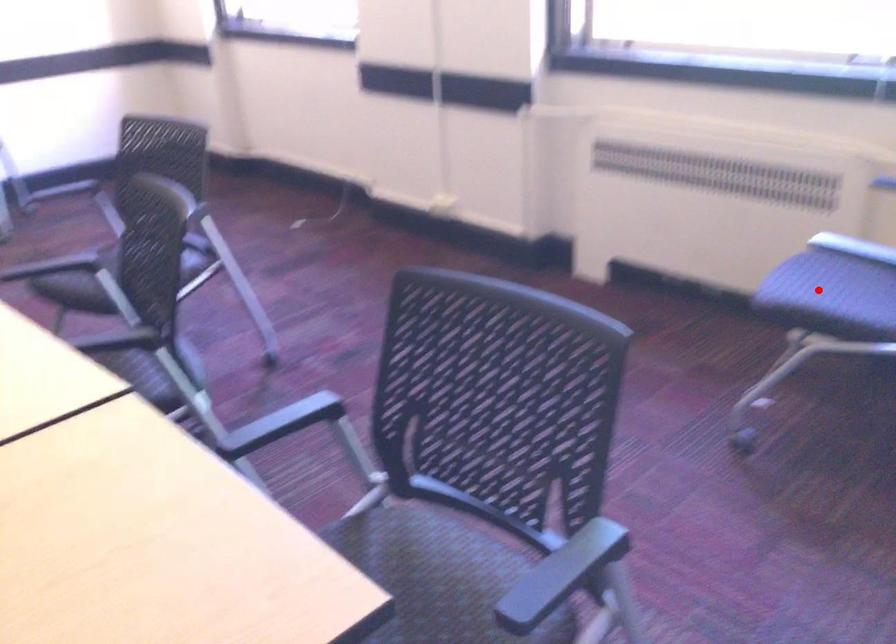
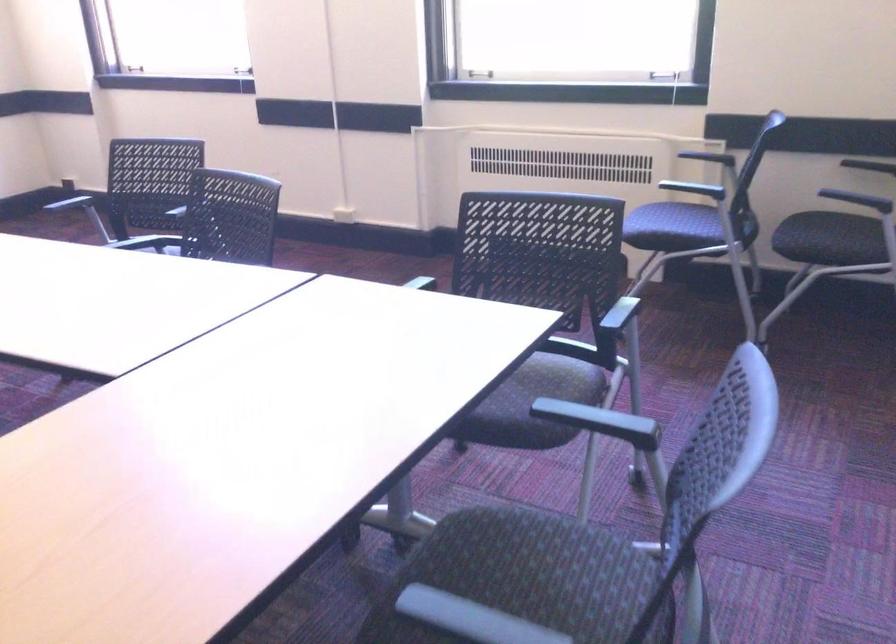
The point at the highlighted location is marked in the first image. Where is the corresponding point in the second image?

(662, 220)